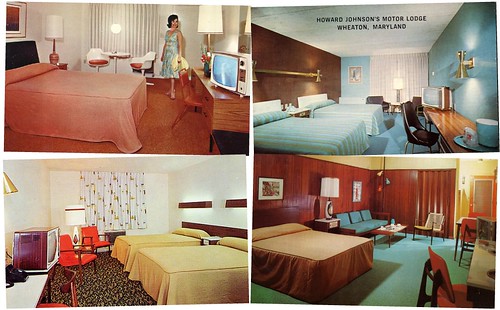
Where is `beds`? This screenshot has height=310, width=500. beds is located at coordinates (97, 98), (315, 130), (368, 108), (328, 251), (199, 264), (145, 236).